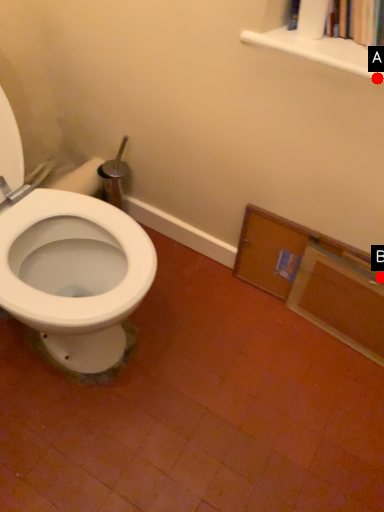
Question: Two points are circled on the image, labeled by A and B beside each circle. Which point is closer to the camera?

Choices:
 (A) A is closer
 (B) B is closer

Answer: (A)